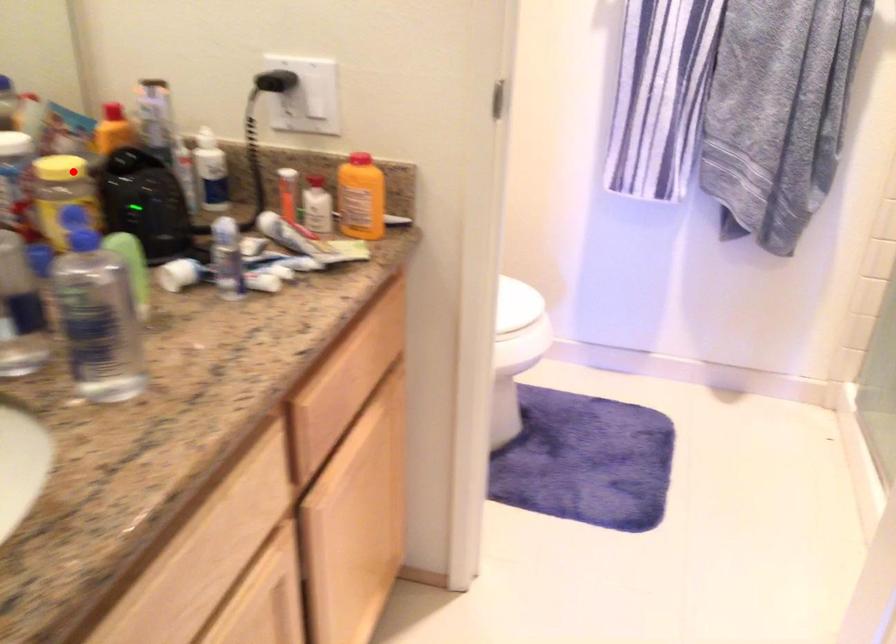
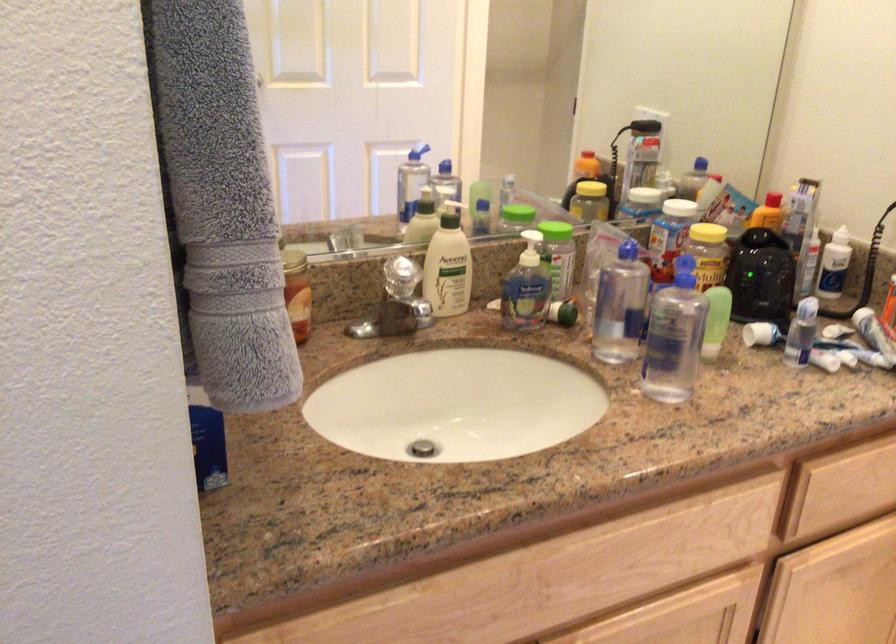
Find the pixel in the second image that matches the highlighted location in the first image.

(707, 232)